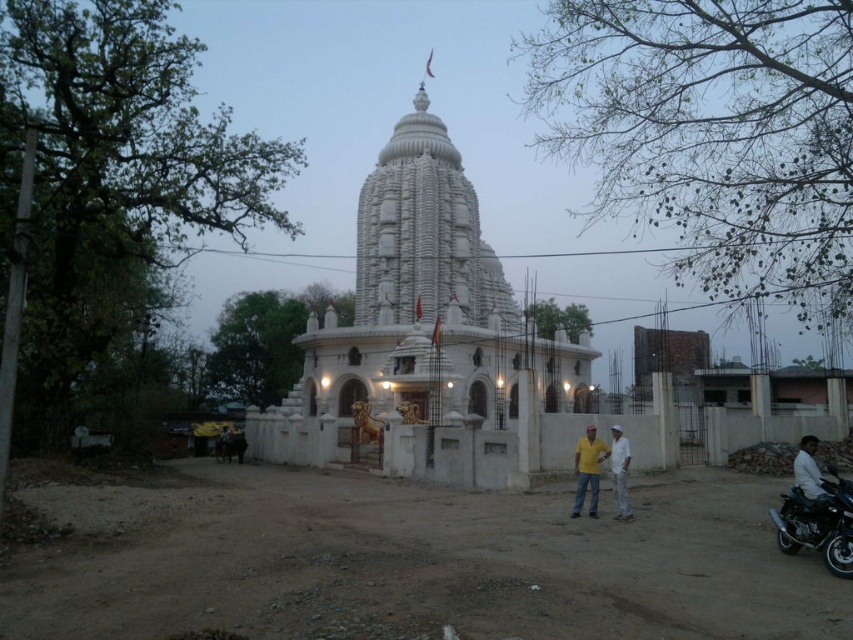
You are a tourist visiting the temple and want to take a photo of the white stone hindu temple at center and the white cotton pants at lower center together in the frame. Can you position yourself in such a way that both objects are visible in the photo without moving either object?

The white cotton pants at lower center is behind the white stone hindu temple at center, so if you position yourself behind the white stone hindu temple at center, you can look over or around it to include both the temple and the pants in the photo.

You are a visitor approaching the temple and see the white stone hindu temple at center and the white cotton pants at lower center. Which object is located to the left of the other?

The white stone hindu temple at center is positioned on the left side of white cotton pants at lower center.